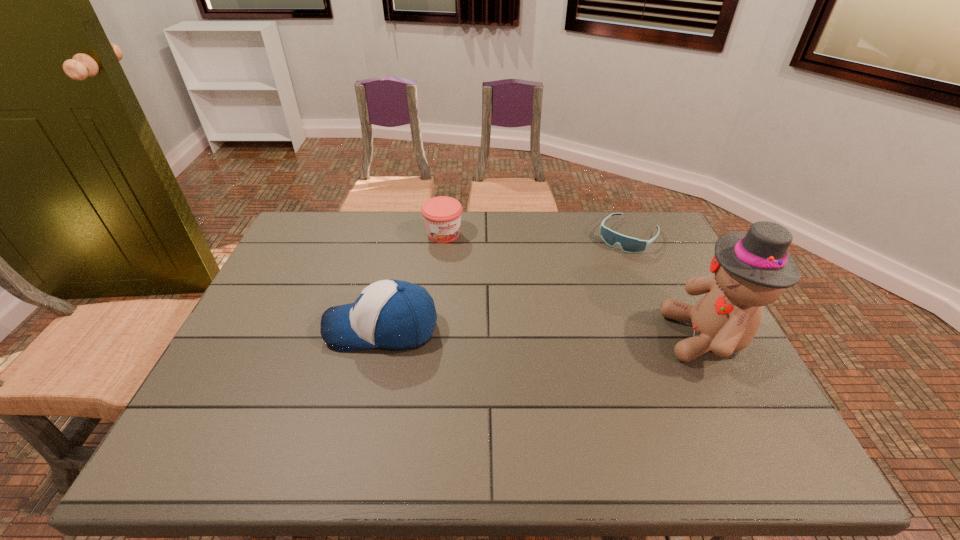
Where is `free point between the rag_doll and the third shortest object`? Image resolution: width=960 pixels, height=540 pixels. free point between the rag_doll and the third shortest object is located at coordinates (544, 333).

You are a GUI agent. You are given a task and a screenshot of the screen. Output one action in this format:
    pyautogui.click(x=<x>, y=<y>)
    Task: Click on the unoccupied area between the baseball cap and the goggles
    
    Given the screenshot: What is the action you would take?
    pyautogui.click(x=505, y=282)

Identify the location of vacant space in between the third shortest object and the second shortest object. (413, 281).

Identify the location of free space between the shortest object and the tallest object. (667, 286).

This screenshot has height=540, width=960. I want to click on vacant area that lies between the rag_doll and the jam, so click(575, 285).

The height and width of the screenshot is (540, 960). In order to click on free space between the third tallest object and the tallest object in this screenshot , I will do `click(575, 285)`.

What are the coordinates of `vacant point located between the tallest object and the jam` in the screenshot? It's located at (575, 285).

This screenshot has height=540, width=960. Find the location of `vacant region between the shortest object and the rag_doll`. vacant region between the shortest object and the rag_doll is located at coordinates (667, 286).

Select which object appears as the second closest to the rag_doll. Please provide its 2D coordinates. Your answer should be formatted as a tuple, i.e. [(x, y)], where the tuple contains the x and y coordinates of a point satisfying the conditions above.

[(392, 314)]

Locate an element on the screen. The image size is (960, 540). the closest object to the rag_doll is located at coordinates (628, 244).